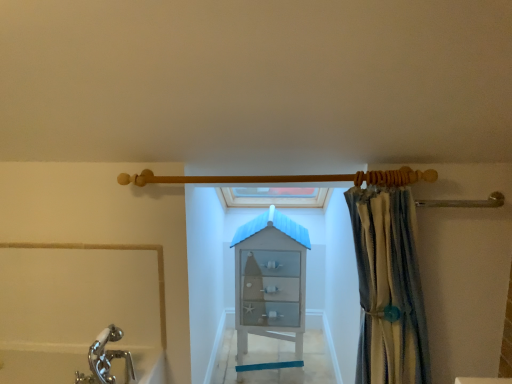
Question: Does white glass cabinet at center appear on the right side of wooden shower rod at upper center?

Choices:
 (A) yes
 (B) no

Answer: (A)

Question: Is white glass cabinet at center completely or partially outside of wooden shower rod at upper center?

Choices:
 (A) no
 (B) yes

Answer: (B)

Question: Does white glass cabinet at center have a greater width compared to wooden shower rod at upper center?

Choices:
 (A) yes
 (B) no

Answer: (A)

Question: Is white glass cabinet at center facing away from wooden shower rod at upper center?

Choices:
 (A) yes
 (B) no

Answer: (B)

Question: From a real-world perspective, is white glass cabinet at center on wooden shower rod at upper center?

Choices:
 (A) no
 (B) yes

Answer: (A)

Question: Is white glass cabinet at center smaller than wooden shower rod at upper center?

Choices:
 (A) no
 (B) yes

Answer: (A)

Question: Is wooden shower rod at upper center thinner than white glass cabinet at center?

Choices:
 (A) yes
 (B) no

Answer: (A)

Question: Considering the relative sizes of wooden shower rod at upper center and white glass cabinet at center in the image provided, is wooden shower rod at upper center bigger than white glass cabinet at center?

Choices:
 (A) no
 (B) yes

Answer: (A)

Question: Considering the relative sizes of wooden shower rod at upper center and white glass cabinet at center in the image provided, is wooden shower rod at upper center smaller than white glass cabinet at center?

Choices:
 (A) no
 (B) yes

Answer: (B)

Question: Does wooden shower rod at upper center lie in front of white glass cabinet at center?

Choices:
 (A) yes
 (B) no

Answer: (A)

Question: From the image's perspective, would you say wooden shower rod at upper center is positioned over white glass cabinet at center?

Choices:
 (A) no
 (B) yes

Answer: (B)

Question: Is wooden shower rod at upper center touching white glass cabinet at center?

Choices:
 (A) yes
 (B) no

Answer: (B)

Question: Considering the relative positions of striped fabric curtain at right and white glass cabinet at center in the image provided, is striped fabric curtain at right to the right of white glass cabinet at center from the viewer's perspective?

Choices:
 (A) yes
 (B) no

Answer: (A)